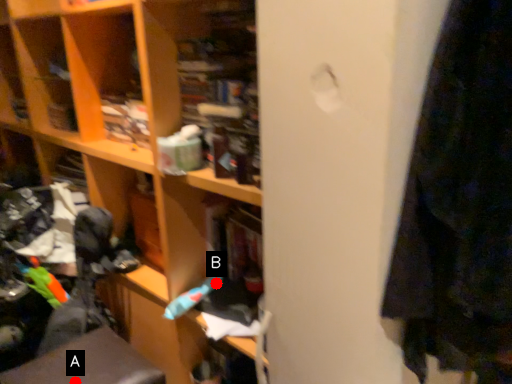
Question: Two points are circled on the image, labeled by A and B beside each circle. Which point is closer to the camera?

Choices:
 (A) A is closer
 (B) B is closer

Answer: (A)